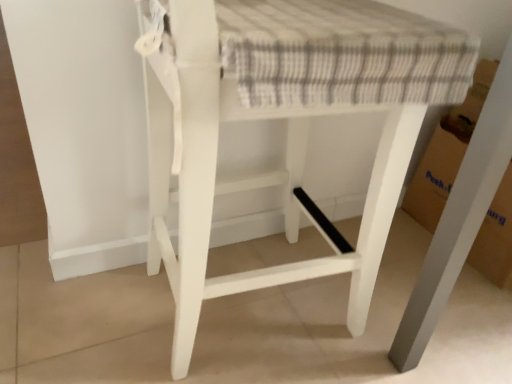
Question: Does cardboard at lower right have a lesser height compared to white painted wood stool at center?

Choices:
 (A) no
 (B) yes

Answer: (B)

Question: Is cardboard at lower right next to white painted wood stool at center?

Choices:
 (A) yes
 (B) no

Answer: (B)

Question: Does cardboard at lower right turn towards white painted wood stool at center?

Choices:
 (A) no
 (B) yes

Answer: (A)

Question: From the image's perspective, is cardboard at lower right located beneath white painted wood stool at center?

Choices:
 (A) no
 (B) yes

Answer: (A)

Question: Considering the relative sizes of cardboard at lower right and white painted wood stool at center in the image provided, is cardboard at lower right wider than white painted wood stool at center?

Choices:
 (A) yes
 (B) no

Answer: (B)

Question: Considering the relative sizes of cardboard at lower right and white painted wood stool at center in the image provided, is cardboard at lower right taller than white painted wood stool at center?

Choices:
 (A) no
 (B) yes

Answer: (A)

Question: Is white painted wood stool at center positioned far away from cardboard at lower right?

Choices:
 (A) yes
 (B) no

Answer: (B)

Question: Is white painted wood stool at center thinner than cardboard at lower right?

Choices:
 (A) no
 (B) yes

Answer: (A)

Question: Is white painted wood stool at center at the left side of cardboard at lower right?

Choices:
 (A) yes
 (B) no

Answer: (A)

Question: Can you confirm if white painted wood stool at center is shorter than cardboard at lower right?

Choices:
 (A) no
 (B) yes

Answer: (A)

Question: Is white painted wood stool at center outside of cardboard at lower right?

Choices:
 (A) no
 (B) yes

Answer: (B)

Question: Is cardboard at lower right completely or partially inside white painted wood stool at center?

Choices:
 (A) no
 (B) yes

Answer: (A)

Question: Considering the positions of white painted wood stool at center and cardboard at lower right in the image, is white painted wood stool at center bigger or smaller than cardboard at lower right?

Choices:
 (A) big
 (B) small

Answer: (A)